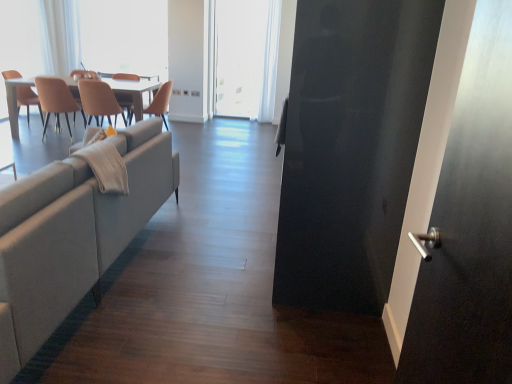
Question: Which is correct: transparent plastic window screen at upper left, the 1th window screen from the left, is inside matte orange chair at left, which appears as the 1th chair when viewed from the left, or outside of it?

Choices:
 (A) outside
 (B) inside

Answer: (A)

Question: From a real-world perspective, is transparent plastic window screen at upper left, the 1th window screen from the left, above or below matte orange chair at left, which appears as the 1th chair when viewed from the left?

Choices:
 (A) below
 (B) above

Answer: (B)

Question: Which object is positioned closest to the white sheer curtain at upper center?

Choices:
 (A) beige leather chair at center, placed as the 1th chair when sorted from right to left
 (B) matte beige chair at center, which is the 3th chair from left to right
 (C) white glossy table at upper left
 (D) matte beige chair at left, placed as the 2th chair when sorted from left to right
 (E) glossy black screen door at right

Answer: (C)

Question: Based on their relative distances, which object is nearer to the white matte window screen at center, arranged as the 2th window screen when viewed from the left?

Choices:
 (A) white glossy table at upper left
 (B) matte beige chair at center, which is the 3th chair from left to right
 (C) beige leather chair at center, which is the fourth chair from left to right
 (D) matte orange chair at left, the fourth chair in the right-to-left sequence
 (E) matte beige chair at left, marked as the 3th chair in a right-to-left arrangement

Answer: (A)